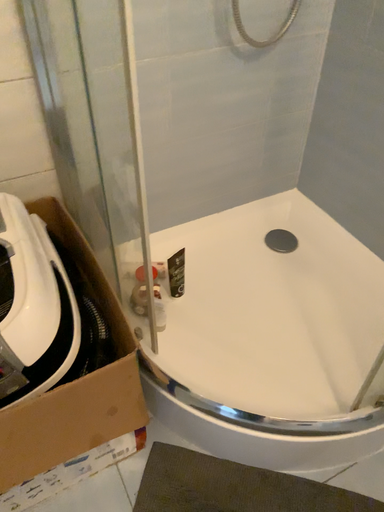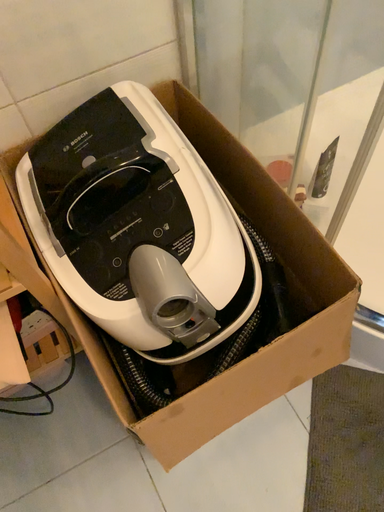
Question: Which way did the camera rotate in the video?

Choices:
 (A) rotated downward
 (B) rotated upward

Answer: (A)